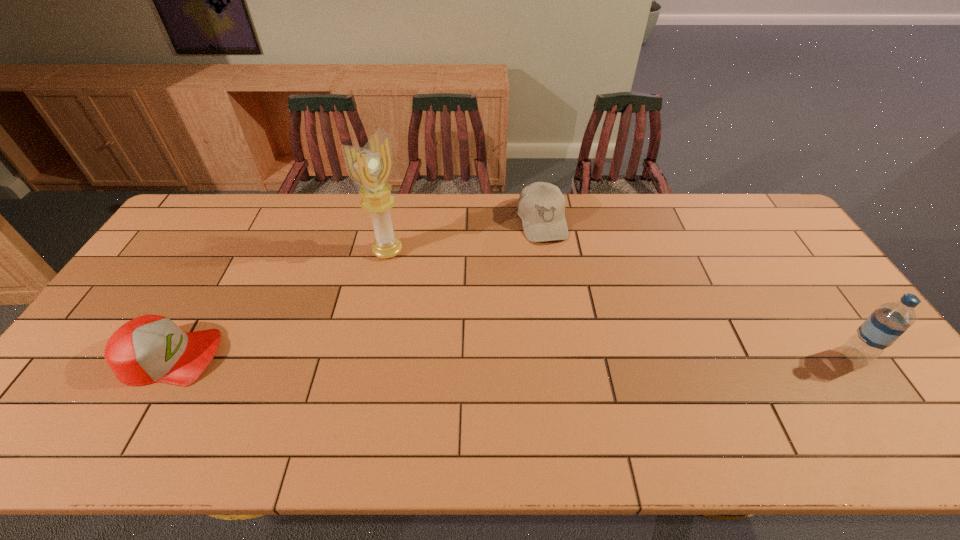
This screenshot has width=960, height=540. I want to click on free space located 0.400m on the front-facing side of the award, so click(x=497, y=328).

Identify the location of vacant space located on the front-facing side of the award. Image resolution: width=960 pixels, height=540 pixels. (486, 320).

Find the location of `vacant space located 0.170m on the front-facing side of the farther baseball cap`. vacant space located 0.170m on the front-facing side of the farther baseball cap is located at coordinates coord(560,284).

Identify the location of vacant space positioned 0.200m on the front-facing side of the farther baseball cap. (563, 291).

Identify the location of vacant space situated 0.230m on the front-facing side of the farther baseball cap. The height and width of the screenshot is (540, 960). point(564,299).

The height and width of the screenshot is (540, 960). In order to click on object that is positioned at the far edge in this screenshot , I will do `click(541, 206)`.

Where is `object present at the near edge`? Image resolution: width=960 pixels, height=540 pixels. object present at the near edge is located at coordinates (151, 348).

The height and width of the screenshot is (540, 960). What are the coordinates of `object that is at the left edge` in the screenshot? It's located at (151, 348).

Locate an element on the screen. The image size is (960, 540). object that is at the right edge is located at coordinates (885, 325).

I want to click on object present at the near left corner, so click(151, 348).